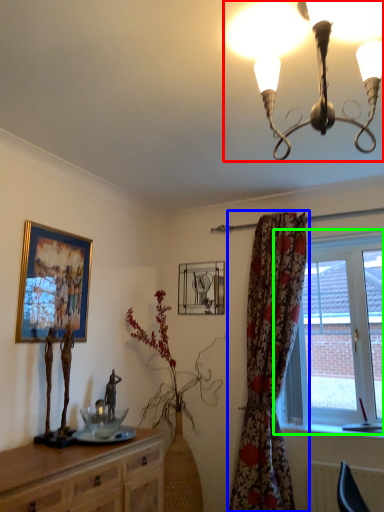
Question: Which object is the closest to the lamp (highlighted by a red box)? Choose among these: curtain (highlighted by a blue box) or window (highlighted by a green box).

Choices:
 (A) curtain
 (B) window

Answer: (A)